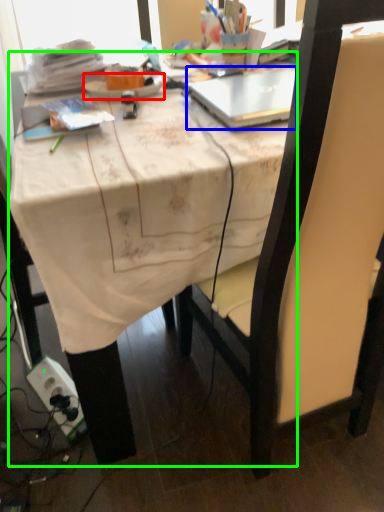
Question: Estimate the real-world distances between objects in this image. Which object is farther from plate (highlighted by a red box), laptop (highlighted by a blue box) or desk (highlighted by a green box)?

Choices:
 (A) laptop
 (B) desk

Answer: (B)